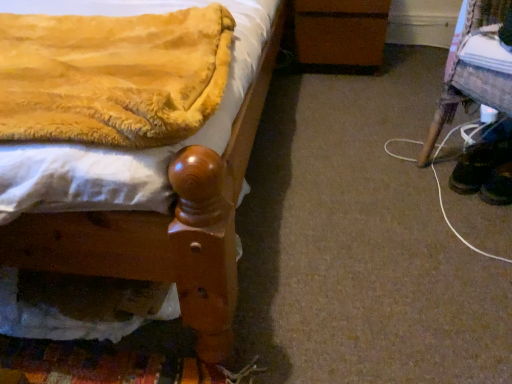
Locate an element on the screen. This screenshot has height=384, width=512. free space in front of brown wooden changing table at center is located at coordinates (351, 89).